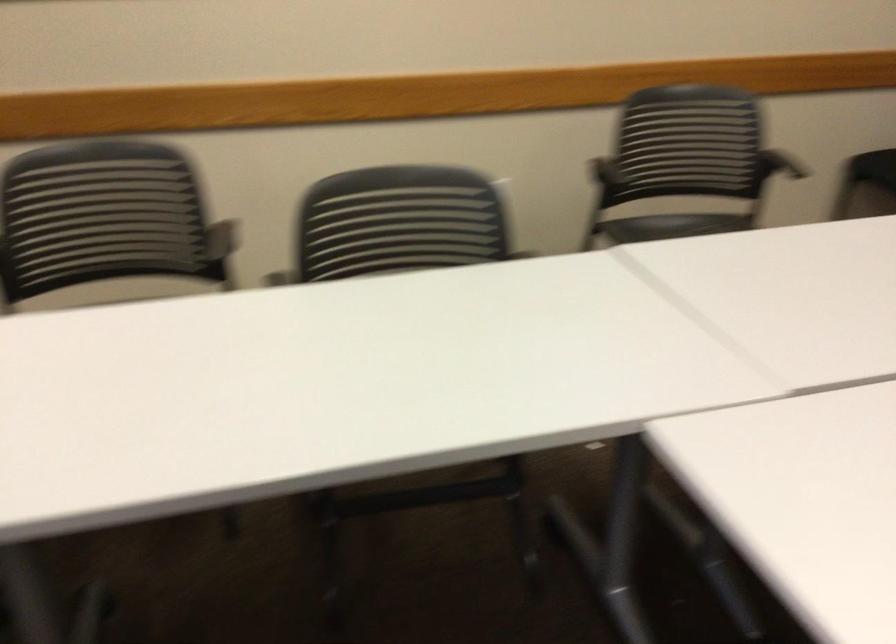
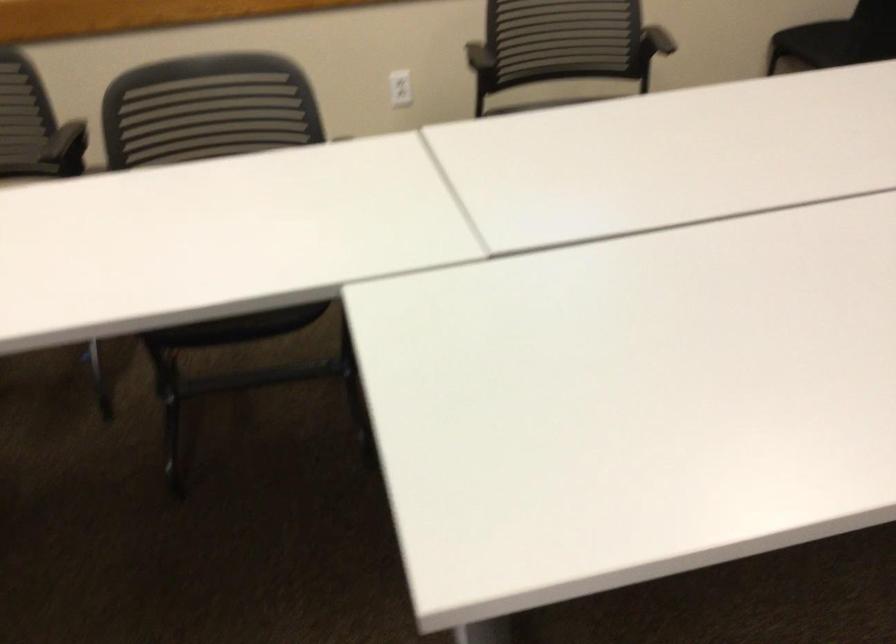
Question: I am providing you with two images of the same scene from different viewpoints. Which of the following objects are not visible in image2?

Choices:
 (A) black chair sitting surface
 (B) wooden chair
 (C) black chair armrest
 (D) chair sitting surface

Answer: (A)